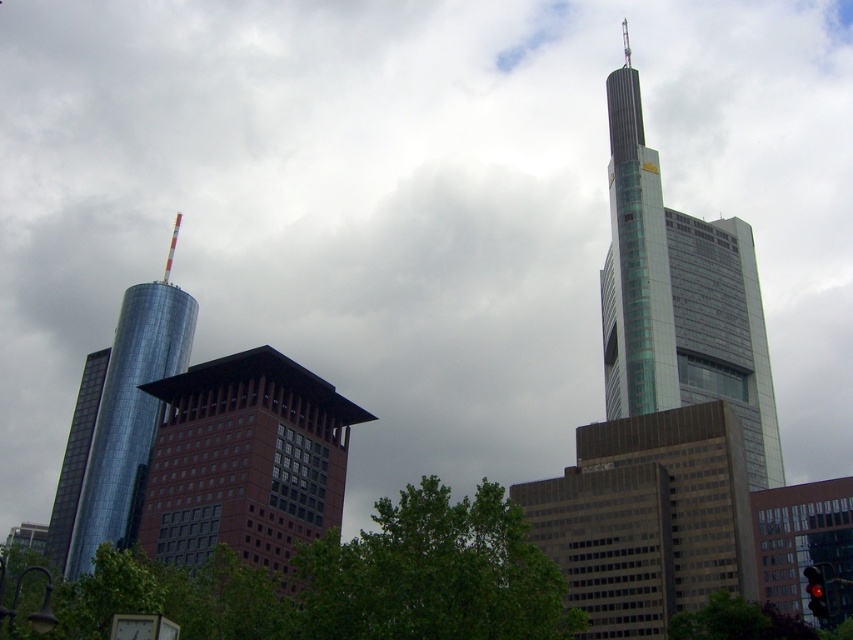
Can you confirm if glassy teal skyscraper at upper right is shorter than green leafy tree at lower right?

No, glassy teal skyscraper at upper right is not shorter than green leafy tree at lower right.

How much distance is there between glassy teal skyscraper at upper right and green leafy tree at lower right?

They are 49.11 meters apart.

Looking at this image, who is more distant from viewer, [640,396] or [756,621]?

The point [640,396] is more distant.

The width and height of the screenshot is (853, 640). I want to click on glassy teal skyscraper at upper right, so click(x=679, y=298).

What do you see at coordinates (117, 422) in the screenshot?
I see `shiny metallic skyscraper at left` at bounding box center [117, 422].

Is shiny metallic skyscraper at left below green leafy tree at lower right?

No.

Does point (100, 380) come in front of point (735, 637)?

No, it is not.

Locate an element on the screen. This screenshot has width=853, height=640. shiny metallic skyscraper at left is located at coordinates 117,422.

Does glassy teal skyscraper at upper right have a greater width compared to shiny metallic skyscraper at left?

Correct, the width of glassy teal skyscraper at upper right exceeds that of shiny metallic skyscraper at left.

Between glassy teal skyscraper at upper right and shiny metallic skyscraper at left, which one appears on the left side from the viewer's perspective?

shiny metallic skyscraper at left is more to the left.

The image size is (853, 640). Find the location of `glassy teal skyscraper at upper right`. glassy teal skyscraper at upper right is located at coordinates (679, 298).